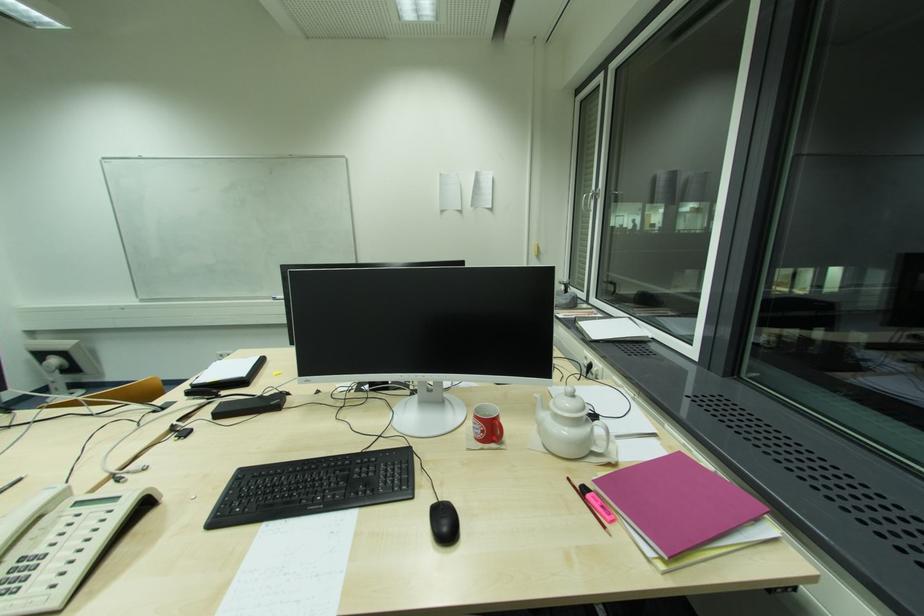
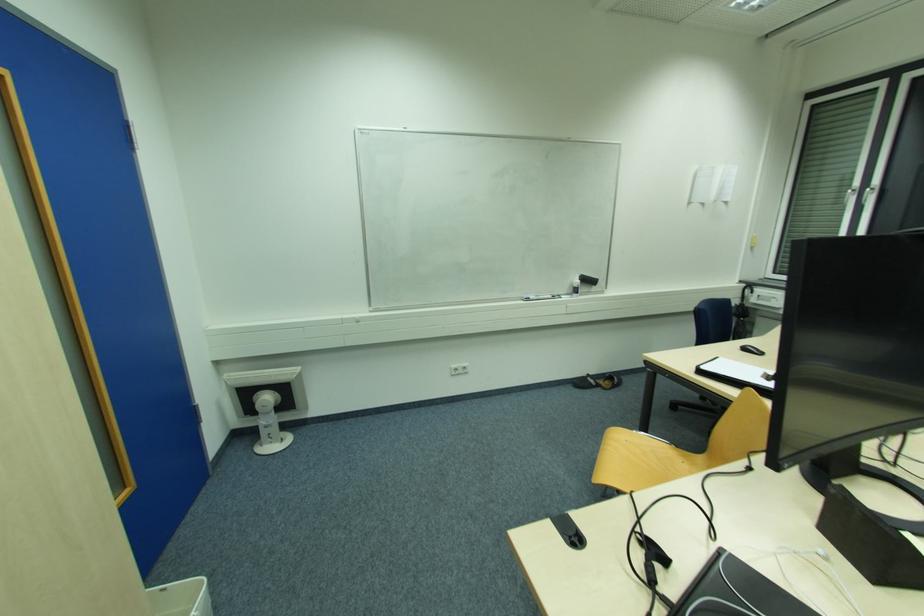
Locate, in the second image, the point that corresponds to (274,175) in the first image.

(550, 158)